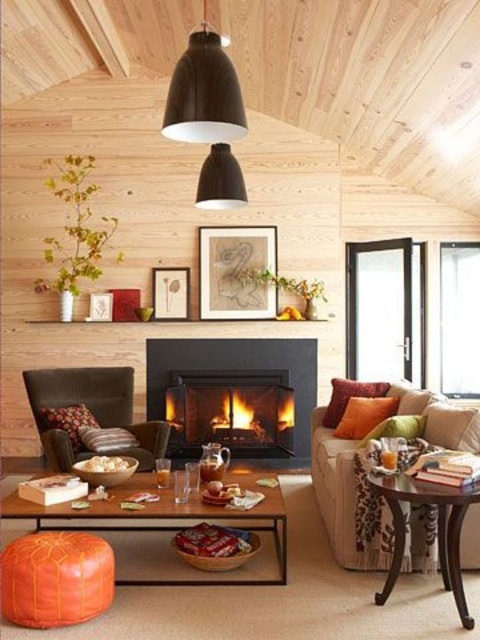
Question: Is brown leather armchair at lower left positioned at the back of cotton cushion at right?

Choices:
 (A) yes
 (B) no

Answer: (A)

Question: Based on their relative distances, which object is nearer to the orange fabric pillow at right?

Choices:
 (A) dark brown wooden side table at right
 (B) orange fabric pillow at center

Answer: (B)

Question: Does velvet beige couch at center appear under striped fabric pillow at center?

Choices:
 (A) no
 (B) yes

Answer: (B)

Question: Which point is farther from the camera taking this photo?

Choices:
 (A) pos(415,436)
 (B) pos(120,410)
 (C) pos(226,518)

Answer: (B)

Question: Which object appears farthest from the camera in this image?

Choices:
 (A) orange fabric pillow at center
 (B) black matte fireplace at center

Answer: (B)

Question: Can you confirm if matte black pendant light at upper center is smaller than orange leather pouf at lower left?

Choices:
 (A) no
 (B) yes

Answer: (A)